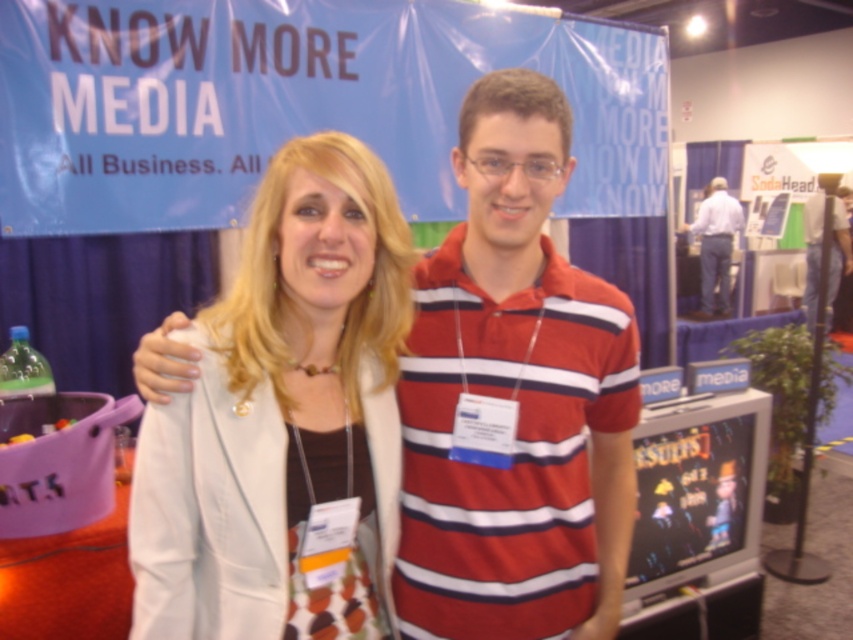
You are a photographer at the convention and need to take a photo of both the white fabric jacket at center and the striped cotton shirt at center. Which clothing item should you focus on first to ensure it is fully visible in the frame?

The striped cotton shirt at center is taller than the white fabric jacket at center, so you should focus on the striped cotton shirt at center first to ensure it is fully visible in the frame.

You are organizing a photoshoot and need to ensure that the white fabric jacket at center and the white shirt at center are displayed properly. Which of these two items is smaller in size?

The white fabric jacket at center is smaller in size compared to the white shirt at center according to the description.

You are an event organizer at the KNOW MORE MEDIA convention. You need to locate the striped cotton polo shirt at center for a quick photo op. According to the coordinates provided, where exactly should you position the camera to capture it?

The striped cotton polo shirt at center is located at coordinates point (514, 397), so position the camera there to capture it.